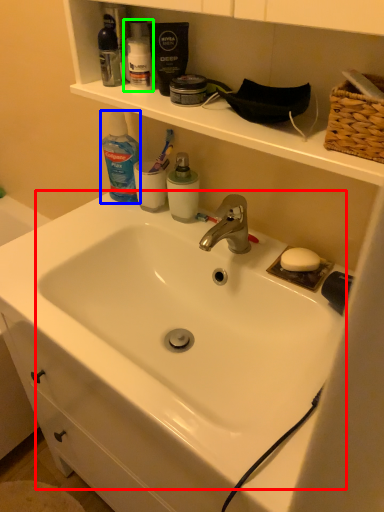
Question: Based on their relative distances, which object is farther from sink (highlighted by a red box)? Choose from cleaning product (highlighted by a blue box) and toiletry (highlighted by a green box).

Choices:
 (A) cleaning product
 (B) toiletry

Answer: (B)